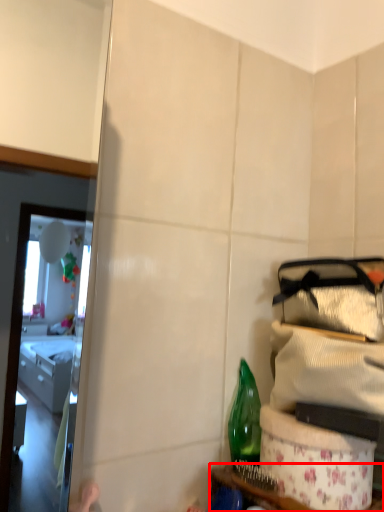
Question: From the image's perspective, where is furniture (annotated by the red box) located relative to bottle?

Choices:
 (A) above
 (B) below

Answer: (B)